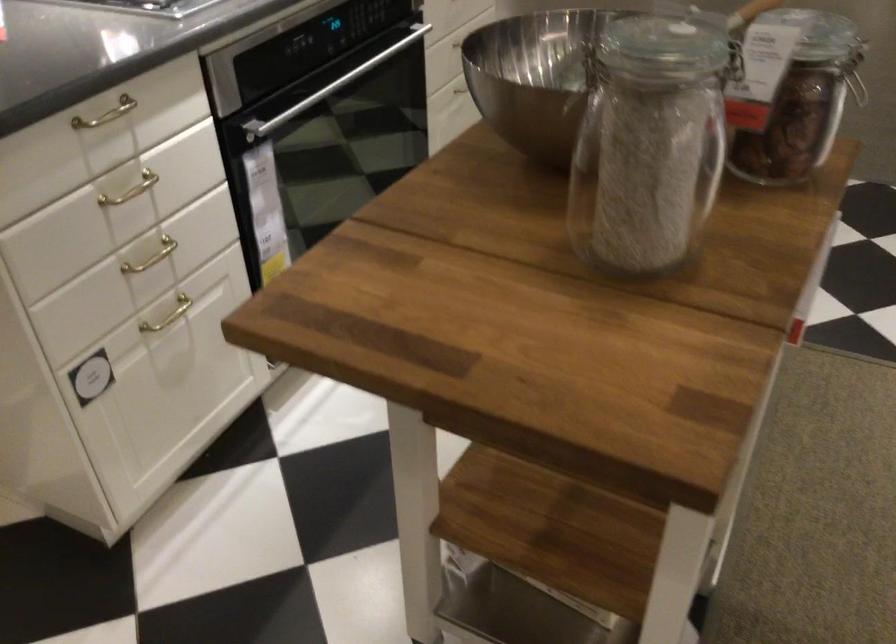
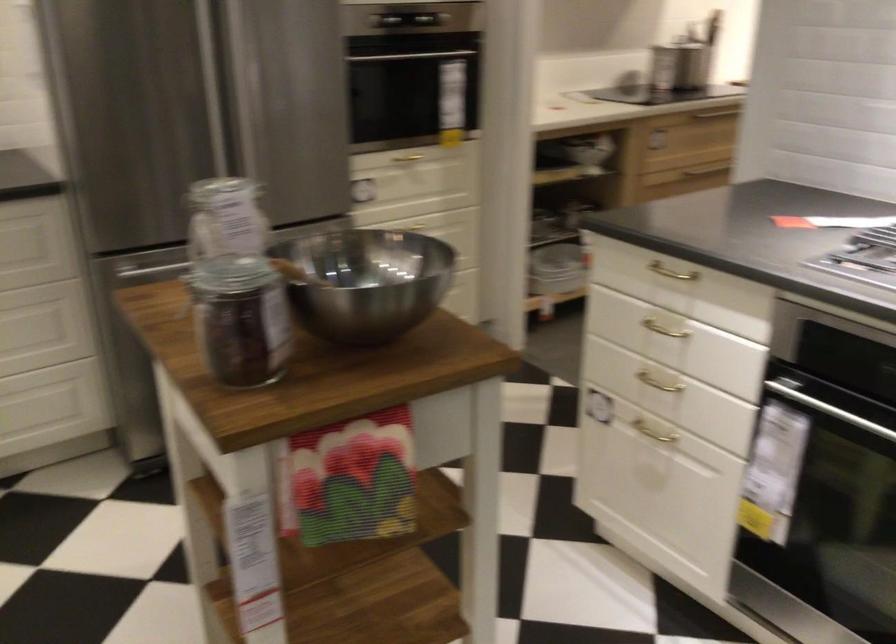
Find the pixel in the second image that matches point (126, 108) in the first image.

(670, 272)